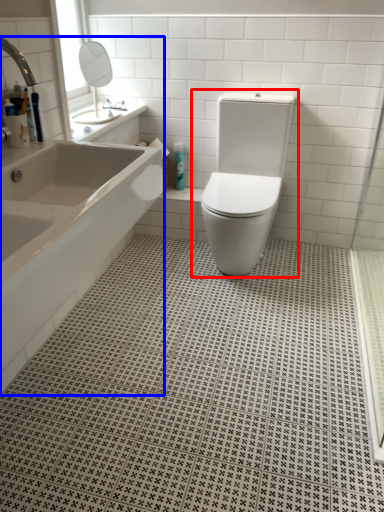
Question: Which object appears farthest to the camera in this image, toilet (highlighted by a red box) or bathtub (highlighted by a blue box)?

Choices:
 (A) toilet
 (B) bathtub

Answer: (A)